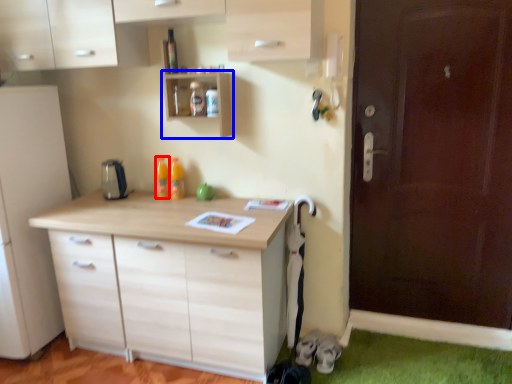
Question: Which object appears closest to the camera in this image, bottle (highlighted by a red box) or shelf (highlighted by a blue box)?

Choices:
 (A) bottle
 (B) shelf

Answer: (B)